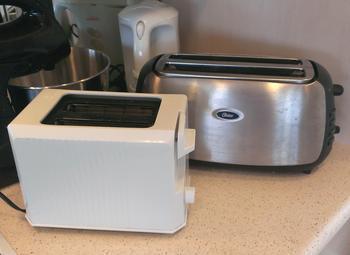
You are a GUI agent. You are given a task and a screenshot of the screen. Output one action in this format:
    pyautogui.click(x=<x>, y=<y>)
    Task: Click on the knob
    This screenshot has width=350, height=255.
    Given the screenshot: What is the action you would take?
    pyautogui.click(x=191, y=185)